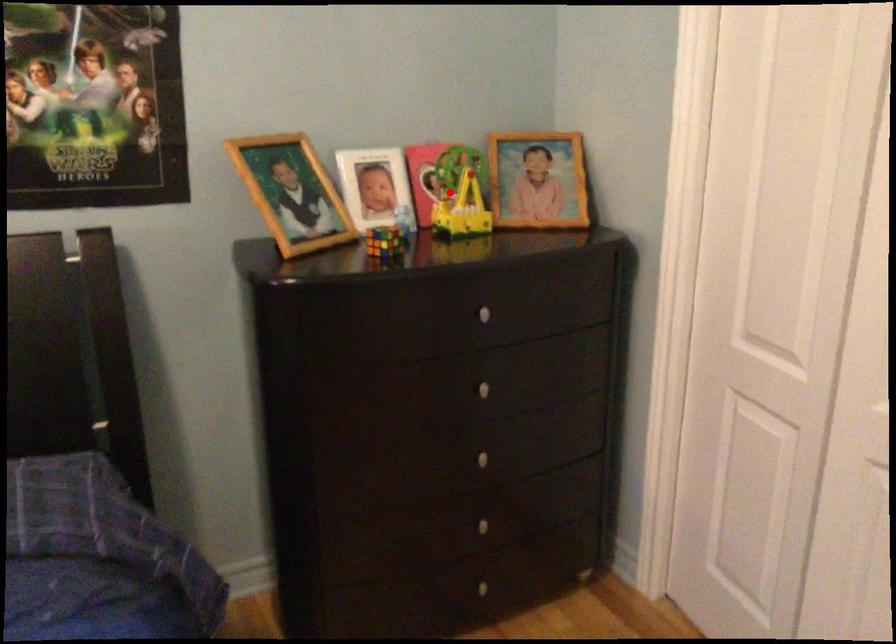
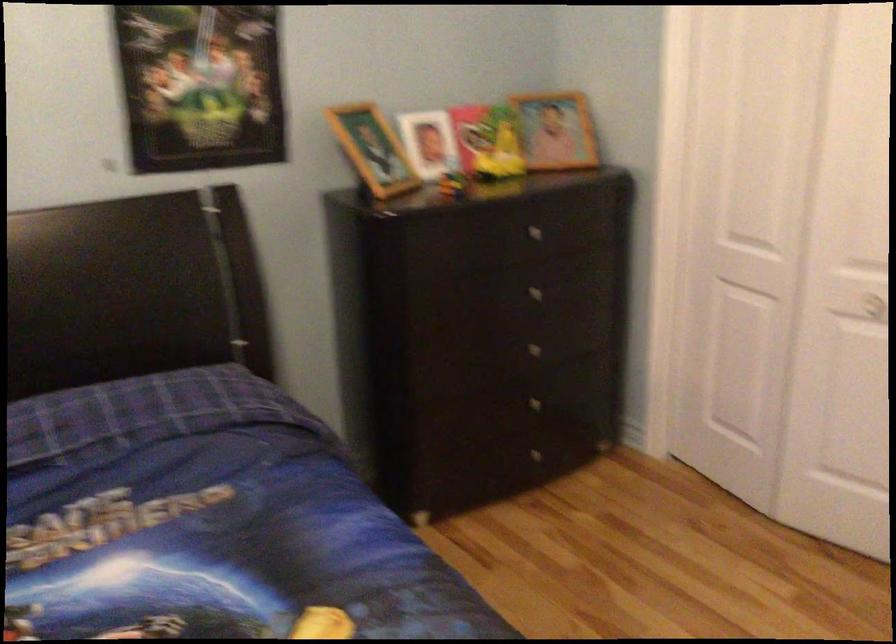
Question: I am providing you with two images of the same scene from different viewpoints. Image1 has a red point marked. In image2, the corresponding 3D location appears at what relative position? Reply with the corresponding letter.

Choices:
 (A) Closer
 (B) Farther

Answer: (B)